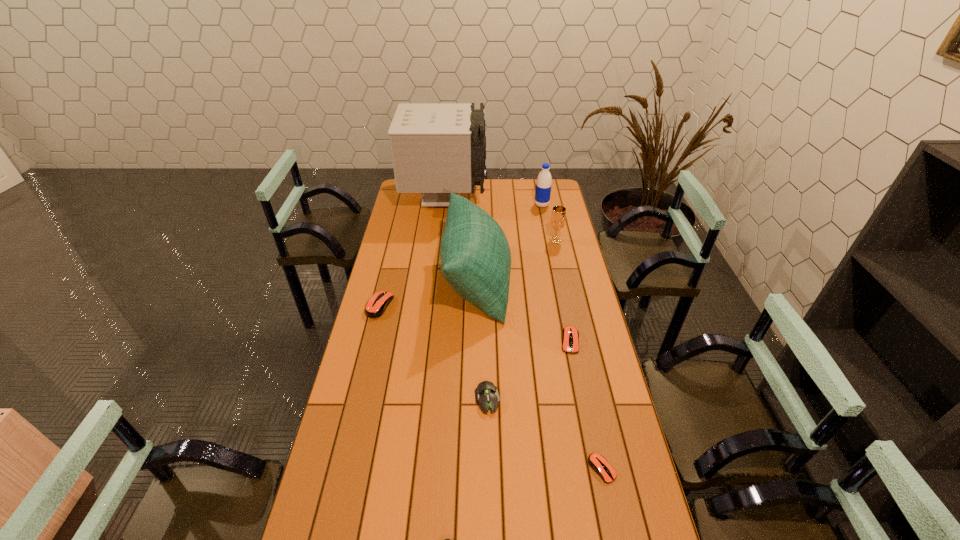
Locate an element on the screen. This screenshot has width=960, height=540. vacant space situated 0.150m on the right of the third nearest computer mouse is located at coordinates tap(546, 399).

I want to click on vacant space situated 0.090m on the back of the smallest orange computer mouse, so click(593, 427).

Locate an element on the screen. fan located in the far edge section of the desktop is located at coordinates (437, 148).

Find the location of a particular element. The width and height of the screenshot is (960, 540). water bottle present at the far edge is located at coordinates (543, 186).

At what (x,y) coordinates should I click in order to perform the action: click on fan that is positioned at the left edge. Please return your answer as a coordinate pair (x, y). This screenshot has width=960, height=540. Looking at the image, I should click on 437,148.

Find the location of a particular element. Image resolution: width=960 pixels, height=540 pixels. computer mouse present at the left edge is located at coordinates (376, 306).

Find the location of a particular element. The height and width of the screenshot is (540, 960). water bottle positioned at the right edge is located at coordinates (543, 186).

Where is `chalice that is positioned at the right edge`? Image resolution: width=960 pixels, height=540 pixels. chalice that is positioned at the right edge is located at coordinates (557, 222).

In order to click on object located at the far left corner in this screenshot , I will do `click(437, 148)`.

Image resolution: width=960 pixels, height=540 pixels. In order to click on object that is positioned at the far right corner in this screenshot , I will do `click(543, 186)`.